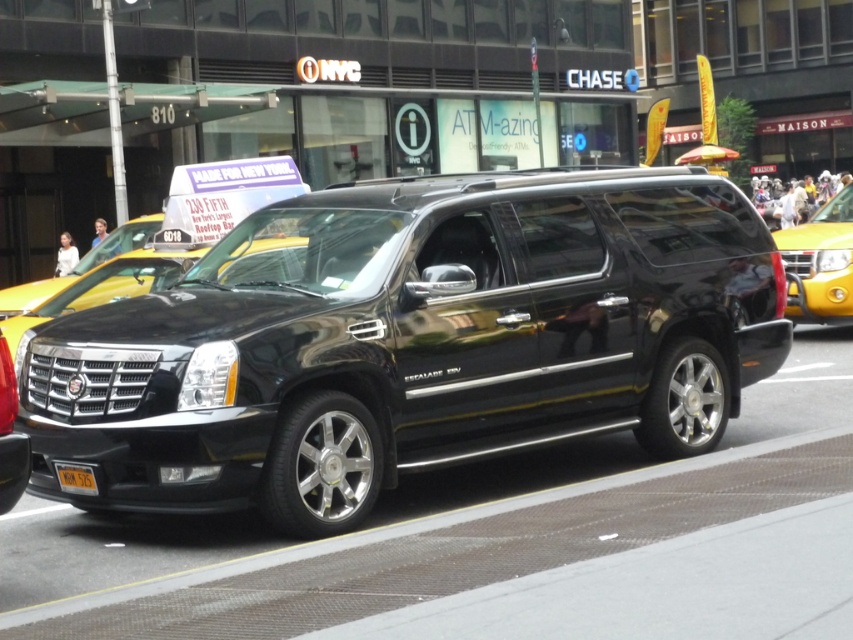
Question: Among these points, which one is farthest from the camera?

Choices:
 (A) (90, 467)
 (B) (154, 273)
 (C) (816, 301)
 (D) (309, 492)

Answer: (C)

Question: Which of the following is the closest to the observer?

Choices:
 (A) shiny black minivan at center
 (B) yellow matte taxi at center
 (C) yellow matte license plate at center

Answer: (A)

Question: Is the position of shiny black minivan at center less distant than that of yellow matte taxi at right?

Choices:
 (A) yes
 (B) no

Answer: (A)

Question: Among these points, which one is nearest to the camera?

Choices:
 (A) (15, 321)
 (B) (798, 310)
 (C) (91, 328)
 (D) (70, 480)

Answer: (D)

Question: From the image, what is the correct spatial relationship of shiny black minivan at center in relation to yellow matte license plate at center?

Choices:
 (A) below
 (B) above

Answer: (B)

Question: Can you confirm if yellow matte taxi at right is smaller than yellow matte taxi at center?

Choices:
 (A) no
 (B) yes

Answer: (B)